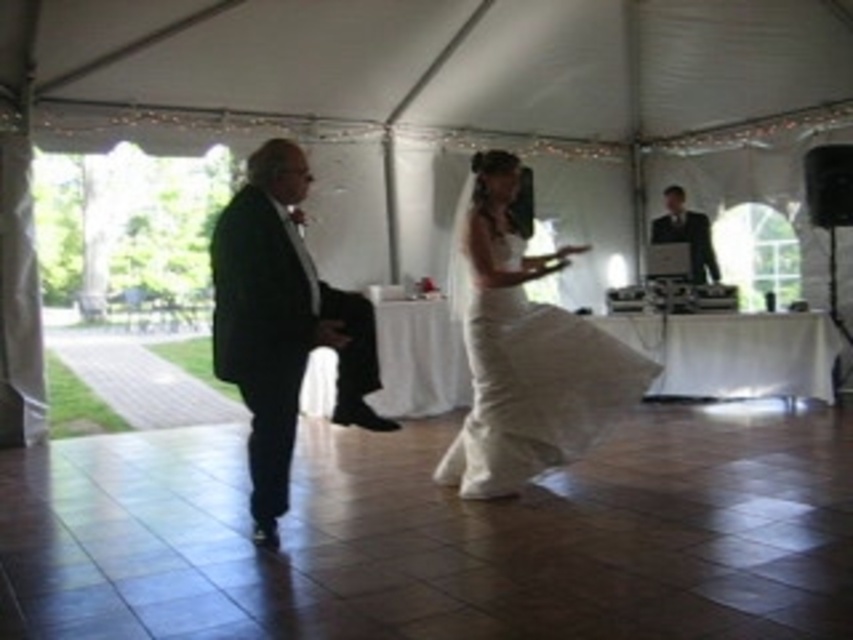
Question: Does white fabric canopy at upper center have a greater width compared to white satin dress at center?

Choices:
 (A) yes
 (B) no

Answer: (A)

Question: Can you confirm if matte black suit at left is positioned to the right of white satin dress at center?

Choices:
 (A) yes
 (B) no

Answer: (B)

Question: Does white satin dress at center have a smaller size compared to black satin suit at left?

Choices:
 (A) no
 (B) yes

Answer: (A)

Question: Which point is closer to the camera taking this photo?

Choices:
 (A) (274, 163)
 (B) (668, 205)
 (C) (328, 336)

Answer: (C)

Question: Which of the following is the farthest from the observer?

Choices:
 (A) black satin suit at left
 (B) matte black suit at upper right
 (C) white fabric canopy at upper center

Answer: (B)

Question: Among these points, which one is nearest to the camera?

Choices:
 (A) (352, 420)
 (B) (218, 339)
 (C) (691, 262)

Answer: (B)